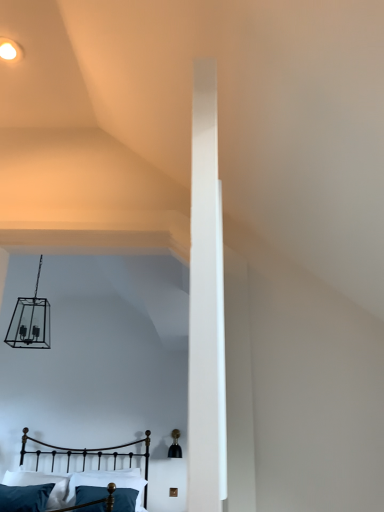
Question: From a real-world perspective, is teal fabric pillow at lower center, which appears as the second pillow when viewed from the left, positioned under matte white ceiling light at upper left based on gravity?

Choices:
 (A) no
 (B) yes

Answer: (B)

Question: Is teal fabric pillow at lower center, acting as the 1th pillow starting from the right, bigger than matte white ceiling light at upper left?

Choices:
 (A) yes
 (B) no

Answer: (A)

Question: Is teal fabric pillow at lower center, which appears as the second pillow when viewed from the left, turned away from matte white ceiling light at upper left?

Choices:
 (A) no
 (B) yes

Answer: (A)

Question: From the image's perspective, would you say teal fabric pillow at lower center, acting as the 1th pillow starting from the right, is positioned over matte white ceiling light at upper left?

Choices:
 (A) yes
 (B) no

Answer: (B)

Question: Is teal fabric pillow at lower center, which appears as the second pillow when viewed from the left, in front of matte white ceiling light at upper left?

Choices:
 (A) yes
 (B) no

Answer: (B)

Question: Does teal fabric pillow at lower center, which appears as the second pillow when viewed from the left, come behind matte white ceiling light at upper left?

Choices:
 (A) no
 (B) yes

Answer: (B)

Question: Can you confirm if matte white ceiling light at upper left is bigger than metallic black bed at lower left?

Choices:
 (A) yes
 (B) no

Answer: (B)

Question: Is matte white ceiling light at upper left closer to the viewer compared to metallic black bed at lower left?

Choices:
 (A) no
 (B) yes

Answer: (B)

Question: Is matte white ceiling light at upper left oriented away from metallic black bed at lower left?

Choices:
 (A) yes
 (B) no

Answer: (B)

Question: Can you confirm if matte white ceiling light at upper left is taller than metallic black bed at lower left?

Choices:
 (A) no
 (B) yes

Answer: (A)

Question: Is matte white ceiling light at upper left positioned beyond the bounds of metallic black bed at lower left?

Choices:
 (A) yes
 (B) no

Answer: (A)

Question: Could you tell me if matte white ceiling light at upper left is turned towards metallic black bed at lower left?

Choices:
 (A) no
 (B) yes

Answer: (A)

Question: Can you confirm if velvety teal pillow at lower left, which is counted as the first pillow, starting from the left, is positioned to the right of metallic black bed at lower left?

Choices:
 (A) yes
 (B) no

Answer: (B)